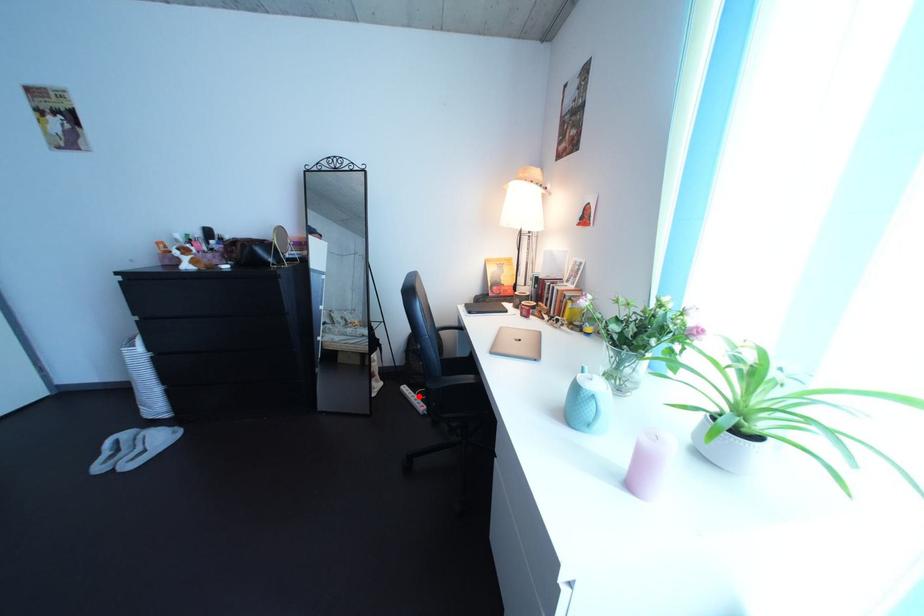
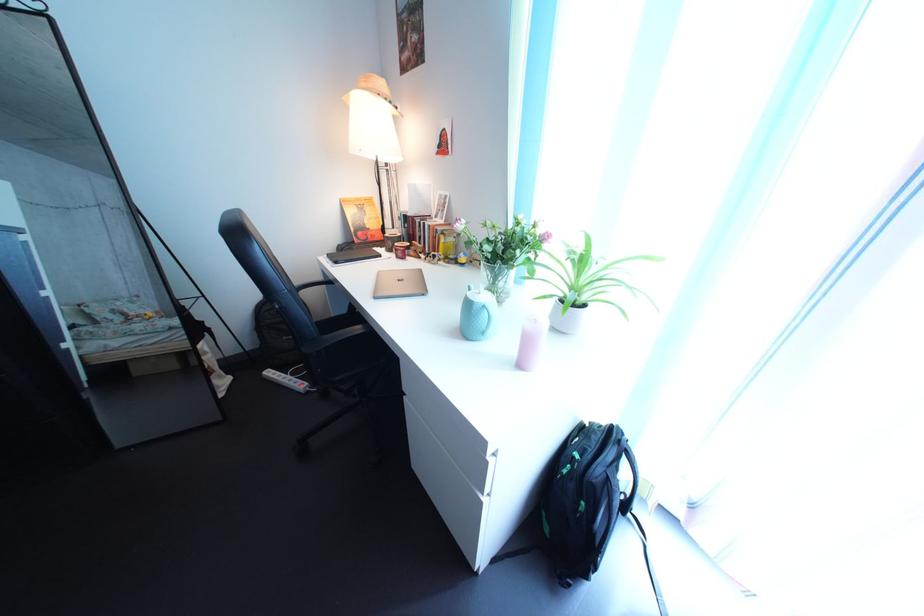
Locate, in the second image, the point that corresponds to the highlighted location in the first image.

(284, 381)